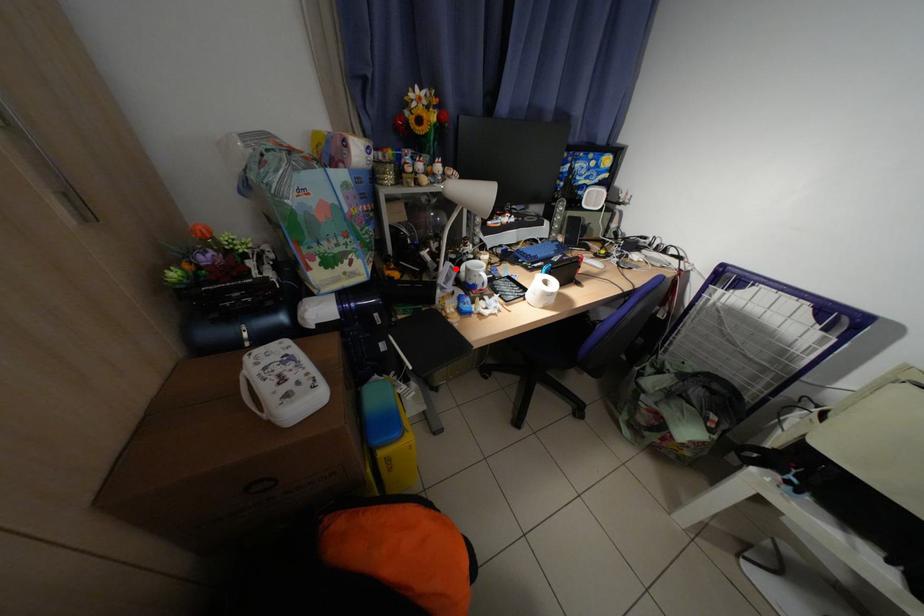
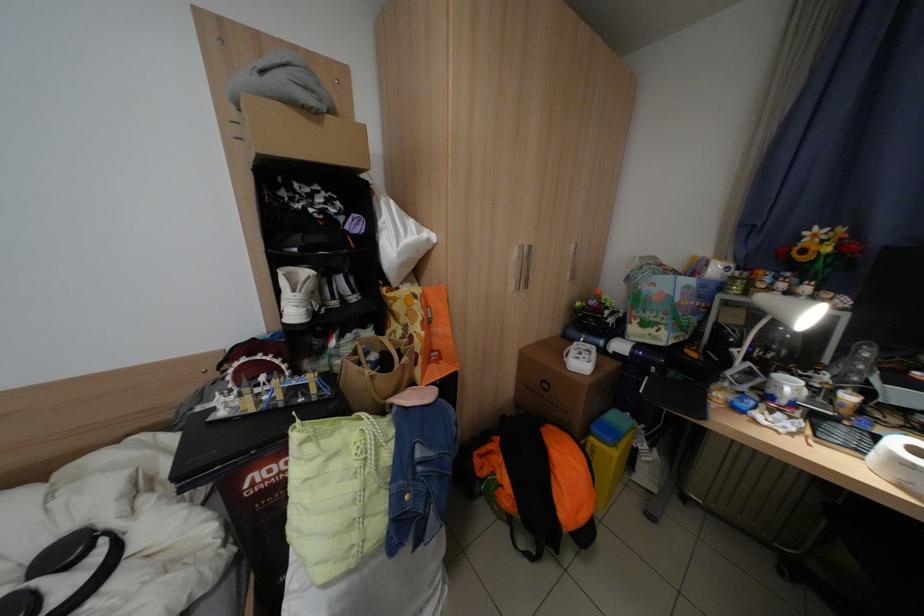
In the second image, find the point that corresponds to the highlighted location in the first image.

(752, 366)